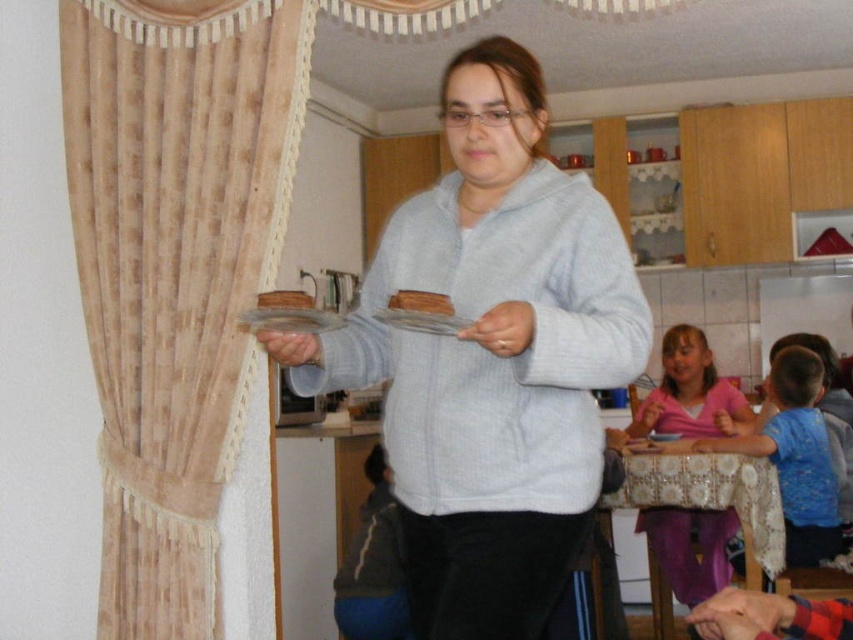
Is beige textured curtain at left below brown wooden cake at center?

Yes, beige textured curtain at left is below brown wooden cake at center.

The height and width of the screenshot is (640, 853). In order to click on beige textured curtain at left in this screenshot , I will do 173,275.

Is beige textured curtain at left positioned at the back of pink fabric shirt at lower right?

No, beige textured curtain at left is closer to the viewer.

Locate an element on the screen. beige textured curtain at left is located at coordinates (173, 275).

Which is below, gray fleece sweater at center or brown crumbly cake at center?

gray fleece sweater at center

Is point (276, 356) less distant than point (450, 301)?

No, it is behind (450, 301).

The height and width of the screenshot is (640, 853). I want to click on gray fleece sweater at center, so click(491, 356).